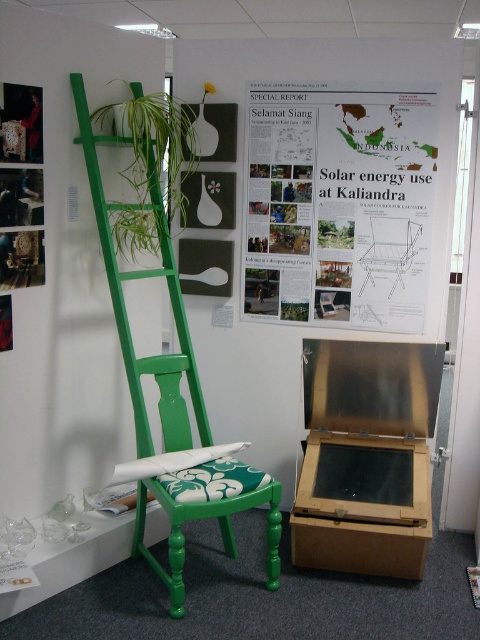
You are an exhibition visitor who wants to take a photo of the green painted wood chair at center without any obstruction. Is the green leafy plant at upper left blocking the view of the chair?

The green painted wood chair at center is positioned under the green leafy plant at upper left, so the plant is blocking the view of the chair from above. To take an unobstructed photo, you would need to move to a position where the plant is not in front of the chair.

What is the position of the white paper at upper center relative to the green leafy plant at upper left?

The white paper at upper center is positioned to the right of the green leafy plant at upper left.

What is the spatial relationship between the white paper at upper center and the green painted wood chair at center?

The white paper at upper center is positioned above the green painted wood chair at center.